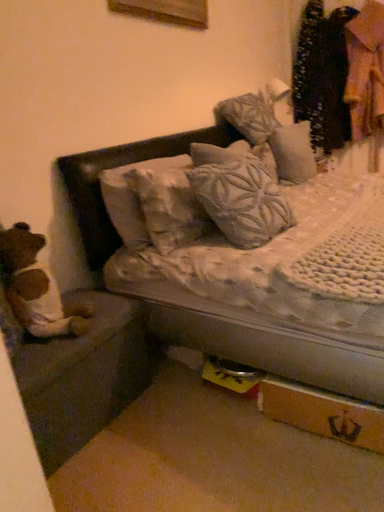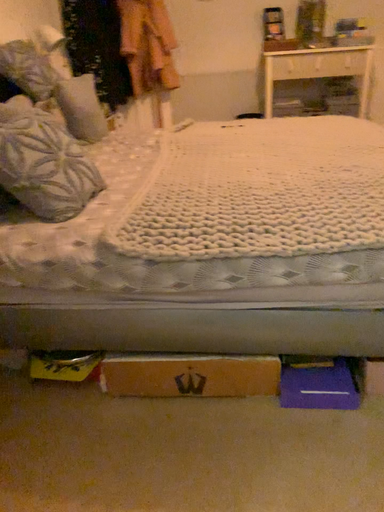
Question: How did the camera likely rotate when shooting the video?

Choices:
 (A) rotated left
 (B) rotated right

Answer: (B)